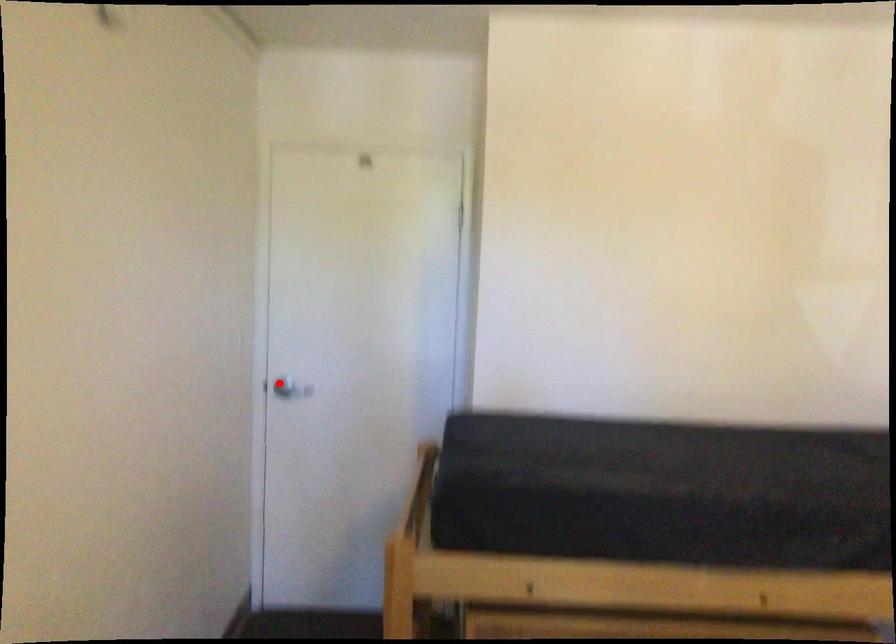
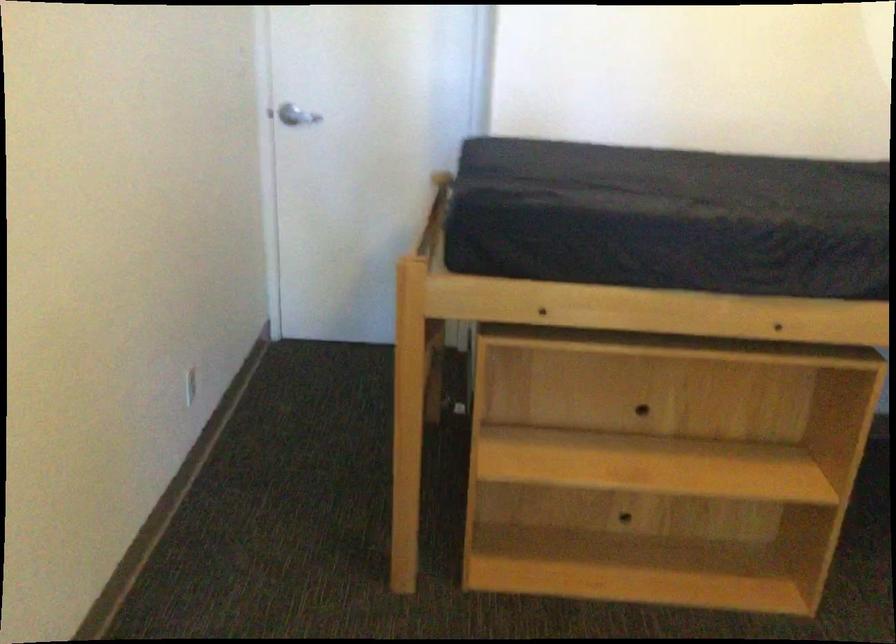
The point at the highlighted location is marked in the first image. Where is the corresponding point in the second image?

(287, 115)